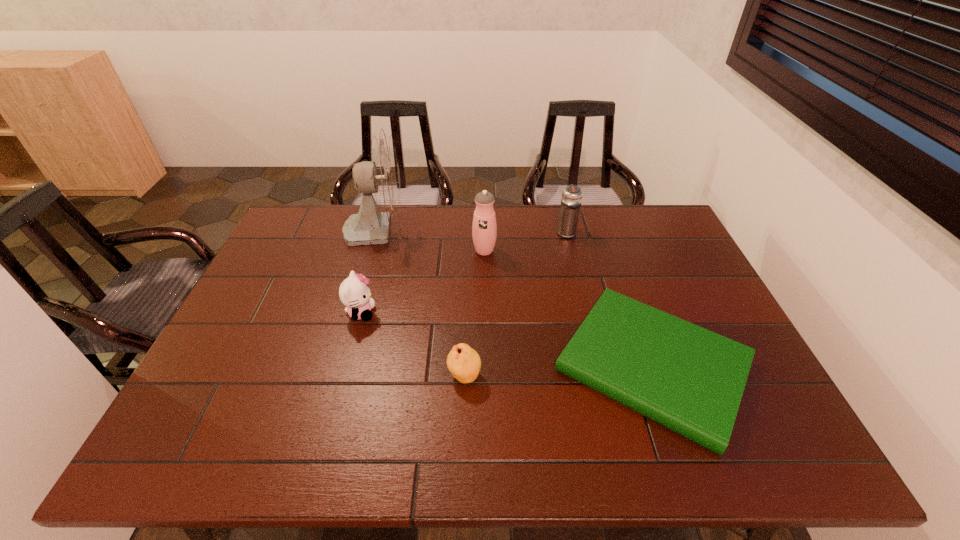
You are a GUI agent. You are given a task and a screenshot of the screen. Output one action in this format:
    pyautogui.click(x=<x>, y=<y>)
    Task: Click on the free space at the far edge of the desktop
    The height and width of the screenshot is (540, 960).
    Given the screenshot: What is the action you would take?
    pyautogui.click(x=617, y=241)

Image resolution: width=960 pixels, height=540 pixels. In the image, there is a desktop. Find the location of `vacant space at the near edge`. vacant space at the near edge is located at coordinates (575, 455).

Locate an element on the screen. vacant space at the left edge of the desktop is located at coordinates (278, 350).

The width and height of the screenshot is (960, 540). I want to click on free space at the right edge of the desktop, so click(x=697, y=272).

Find the location of `vacant position at the far left corner of the desktop`. vacant position at the far left corner of the desktop is located at coordinates (287, 228).

The image size is (960, 540). What are the coordinates of `free space at the far right corner` in the screenshot? It's located at (656, 212).

Locate an element on the screen. The image size is (960, 540). empty space between the pear and the taller thermos bottle is located at coordinates (474, 313).

Find the location of a particular element. Image resolution: width=960 pixels, height=540 pixels. free point between the fourth tallest object and the paperback book is located at coordinates (507, 340).

Identify the location of vacant space that's between the paperback book and the fan. The image size is (960, 540). (515, 298).

Where is `empty space that is in between the fan and the paperback book`? The width and height of the screenshot is (960, 540). empty space that is in between the fan and the paperback book is located at coordinates (515, 298).